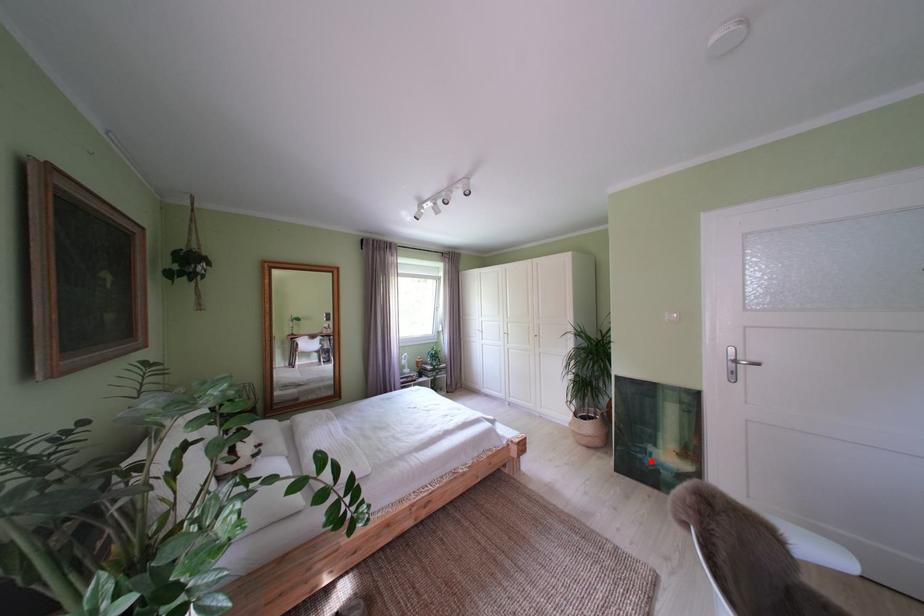
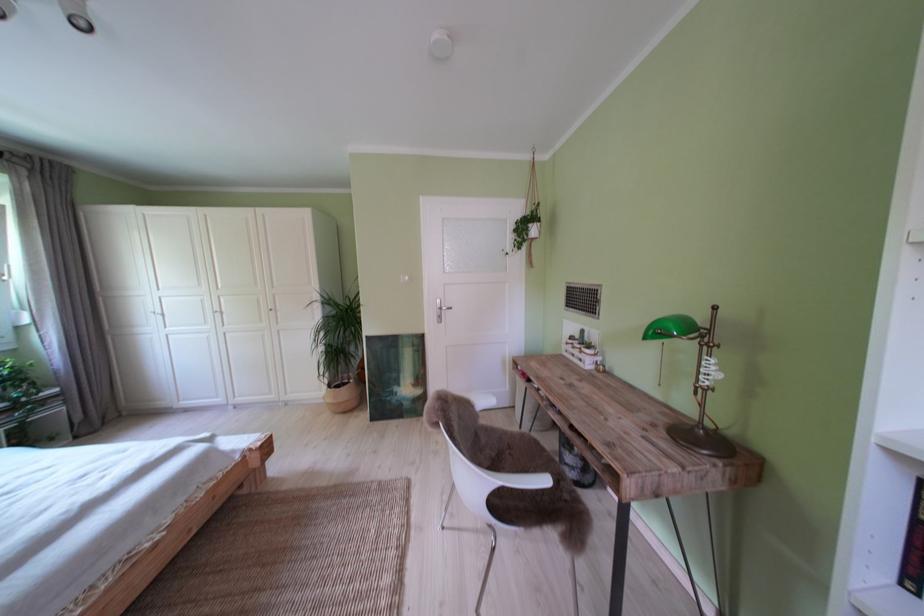
Question: I am providing you with two images of the same scene from different viewpoints. In image1, a red point is highlighted. Considering the same 3D point in image2, which of the following is correct?

Choices:
 (A) It is closer
 (B) It is farther

Answer: (B)